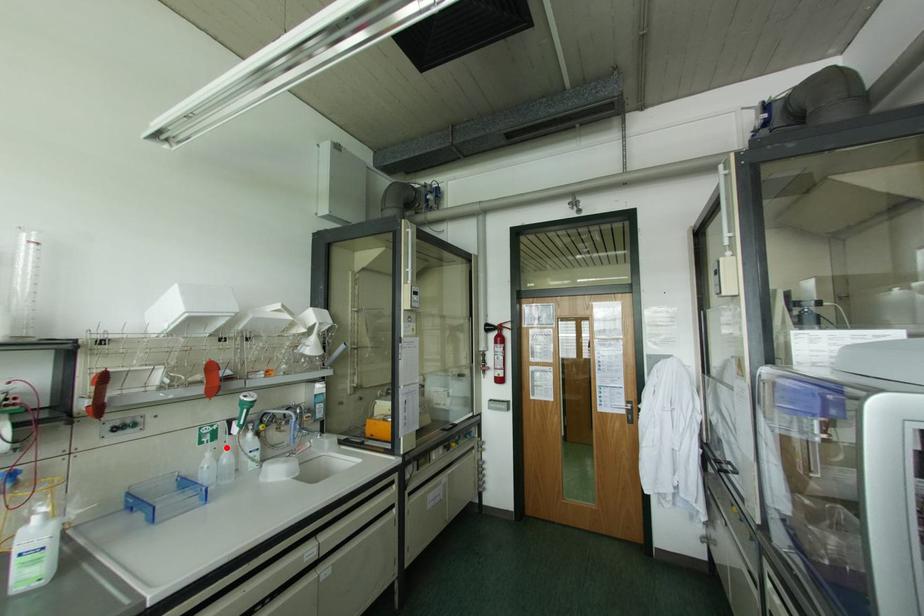
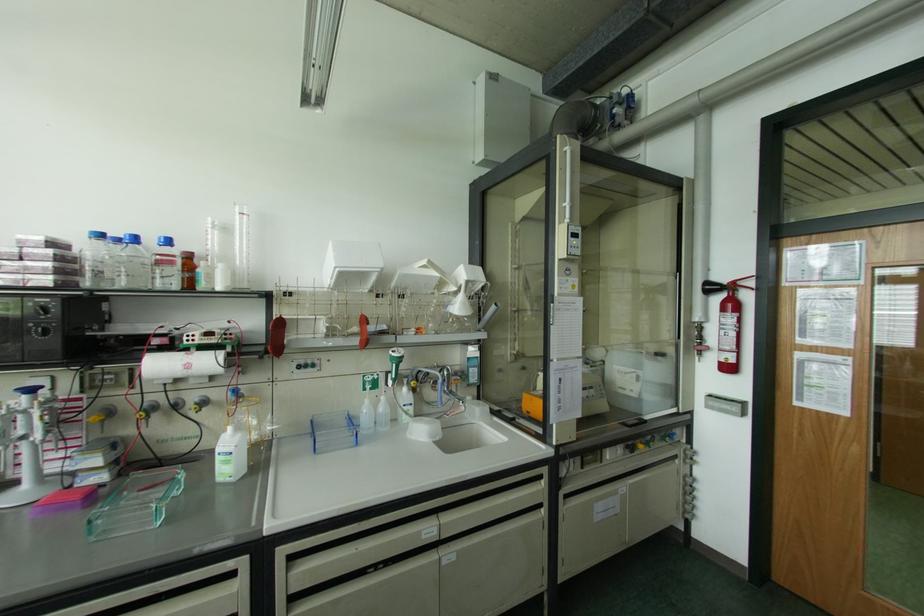
Find the pixel in the second image that matches the highlighted location in the first image.

(382, 398)